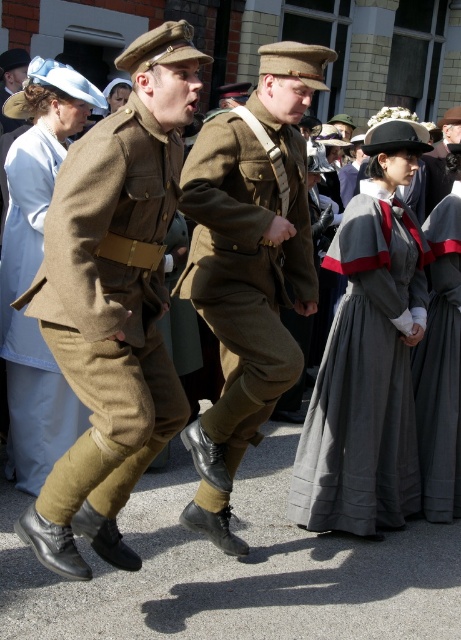
Based on the photo, you are a photographer at the event and want to capture a photo that includes both the point at (x=118, y=492) and the point at (x=272, y=58). To ensure both are in focus, you need to know which point is closer to the camera. Which point is closer?

Point (x=118, y=492) is in front of point (x=272, y=58), so it is closer to the camera.

You are a photographer positioned at the origin of the coordinate system in this scene. You need to capture a closeup shot of the matte brown uniform at center. What are the coordinates you should aim your camera at?

The coordinates to aim the camera at are point (112, 301), as that is where the matte brown uniform at center is located.

You are organizing a historical reenactment event and need to ensure proper spacing between the khaki wool uniform at center and dark gray cotton dress at center. Given their sizes, which one requires more space to accommodate comfortably?

The khaki wool uniform at center requires more space to accommodate comfortably since it has a larger size compared to the dark gray cotton dress at center.